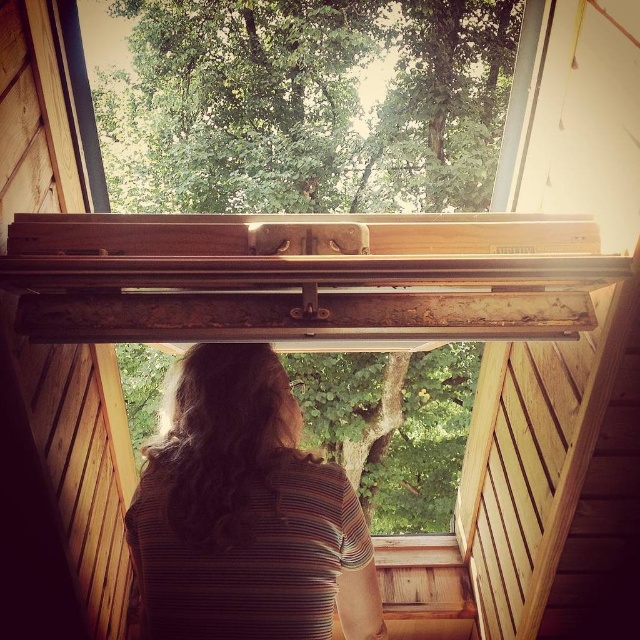
Which is below, green leafy tree at upper center or brown striped shirt at center?

Positioned lower is brown striped shirt at center.

Based on the photo, is green leafy tree at upper center below brown striped shirt at center?

No.

Is point (260, 65) behind point (301, 550)?

That is True.

What are the coordinates of `green leafy tree at upper center` in the screenshot? It's located at (305, 104).